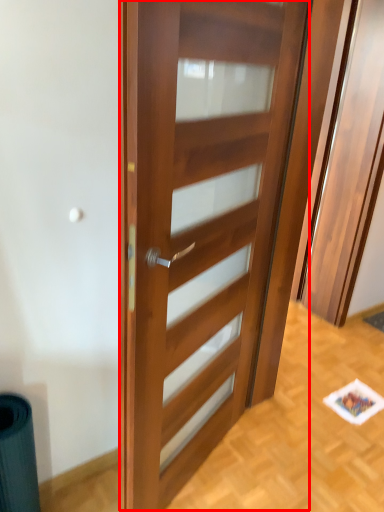
Question: In this image, where is door (annotated by the red box) located relative to elevator?

Choices:
 (A) right
 (B) left

Answer: (B)